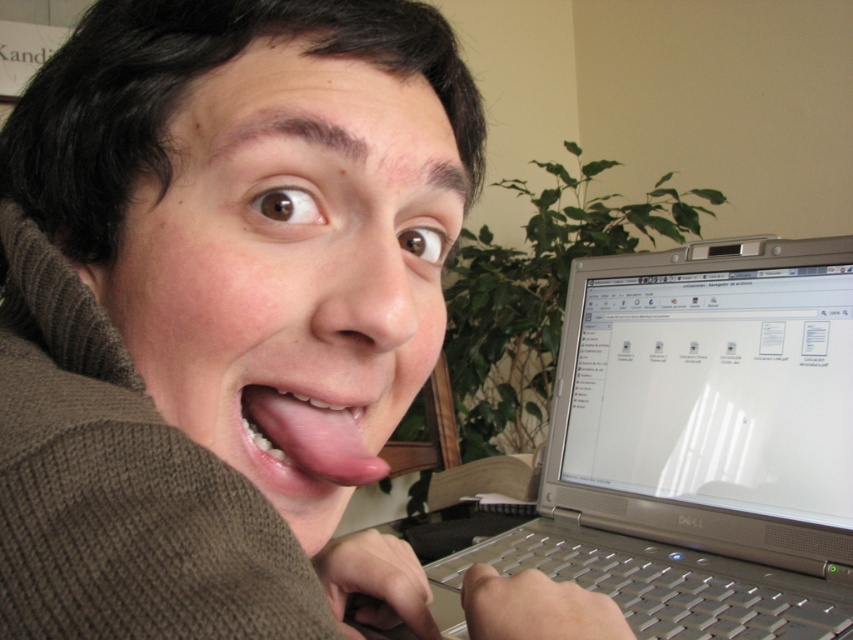
What do you see at coordinates (712, 381) in the screenshot? The image size is (853, 640). I see `silver metallic laptop at upper right` at bounding box center [712, 381].

Find the location of a particular element. This screenshot has height=640, width=853. silver metallic laptop at upper right is located at coordinates (712, 381).

Is matte brown sweater at center further to camera compared to silver metallic laptop at right?

No, it is in front of silver metallic laptop at right.

Is matte brown sweater at center shorter than silver metallic laptop at right?

Correct, matte brown sweater at center is not as tall as silver metallic laptop at right.

Is point (140, 353) less distant than point (828, 259)?

Yes, point (140, 353) is closer to viewer.

At what (x,y) coordinates should I click in order to perform the action: click on matte brown sweater at center. Please return your answer as a coordinate pair (x, y). Looking at the image, I should click on (291, 269).

Which is more to the right, matte silver laptop at center or matte brown sweater at center?

matte brown sweater at center is more to the right.

Which of these two, matte silver laptop at center or matte brown sweater at center, stands taller?

With more height is matte silver laptop at center.

The width and height of the screenshot is (853, 640). In order to click on matte silver laptop at center in this screenshot , I will do `click(218, 307)`.

What are the coordinates of `matte silver laptop at center` in the screenshot? It's located at (218, 307).